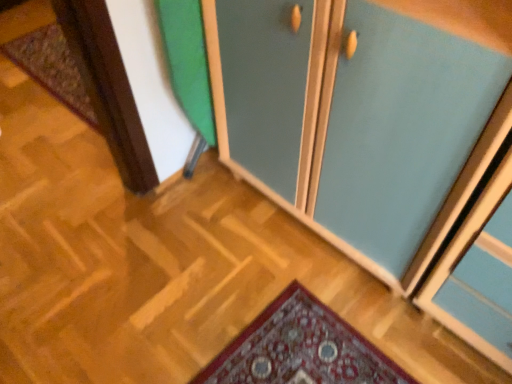
Question: Considering the relative positions of carpeted mat at left and teal matte cabinet at center in the image provided, is carpeted mat at left in front of teal matte cabinet at center?

Choices:
 (A) no
 (B) yes

Answer: (A)

Question: Is there a large distance between carpeted mat at left and teal matte cabinet at center?

Choices:
 (A) yes
 (B) no

Answer: (A)

Question: Could you tell me if carpeted mat at left is turned towards teal matte cabinet at center?

Choices:
 (A) no
 (B) yes

Answer: (A)

Question: Does carpeted mat at left have a smaller size compared to teal matte cabinet at center?

Choices:
 (A) no
 (B) yes

Answer: (B)

Question: Does carpeted mat at left appear on the left side of teal matte cabinet at center?

Choices:
 (A) no
 (B) yes

Answer: (B)

Question: Does carpeted mat at left appear on the right side of teal matte cabinet at center?

Choices:
 (A) no
 (B) yes

Answer: (A)

Question: Is teal matte cabinet at center far from carpeted mat at left?

Choices:
 (A) no
 (B) yes

Answer: (B)

Question: Is carpeted mat at left inside teal matte cabinet at center?

Choices:
 (A) no
 (B) yes

Answer: (A)

Question: From a real-world perspective, is teal matte cabinet at center under carpeted mat at left?

Choices:
 (A) yes
 (B) no

Answer: (B)

Question: Is teal matte cabinet at center oriented away from carpeted mat at left?

Choices:
 (A) no
 (B) yes

Answer: (A)

Question: Considering the relative positions of teal matte cabinet at center and carpeted mat at left in the image provided, is teal matte cabinet at center to the right of carpeted mat at left from the viewer's perspective?

Choices:
 (A) yes
 (B) no

Answer: (A)

Question: Is teal matte cabinet at center in front of carpeted mat at left?

Choices:
 (A) yes
 (B) no

Answer: (A)

Question: Considering the positions of point (29, 54) and point (345, 187), is point (29, 54) closer or farther from the camera than point (345, 187)?

Choices:
 (A) closer
 (B) farther

Answer: (B)